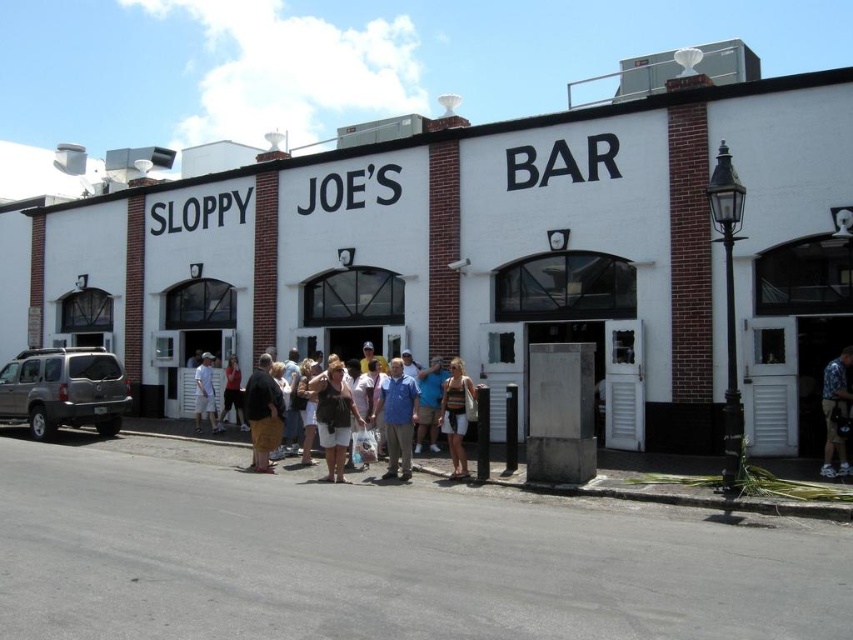
You are standing at the entrance of Sloppy Joe Bar. You see a point marked at coordinates (466, 248). What does this point indicate?

The point marked at coordinates (466, 248) indicates the location of the white brick building at center.

You are trying to decide which pair of shorts to buy based on the image. Both the matte white shorts at center and the white cotton shorts at center are available. If you want a larger size, which one should you choose?

The white cotton shorts at center are larger in size compared to the matte white shorts at center, so you should choose the white cotton shorts at center if you want a larger size.

You are standing outside Sloppy Joe s Bar and want to take a photo of two specific points on the building s facade. The first point is at coordinates point (416, 394) and the second is at point (200, 412). Which point will appear larger in your camera view?

Point (416, 394) is closer to the viewer than point (200, 412). Therefore, the first point will appear larger in the camera view because it is nearer to the camera.